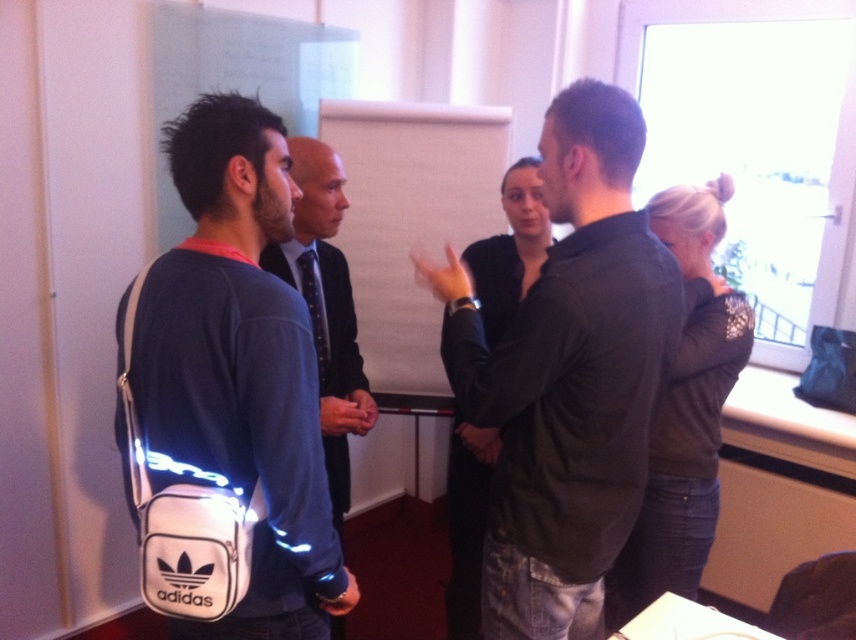
You are organizing a meeting and need to place a name tag on the table between the white synthetic adidas bag at left and the blue denim shirt at center. Which side of the table should you place it closer to so it is equidistant to both?

The white synthetic adidas bag at left is positioned on the left side of the blue denim shirt at center. To place the name tag equidistant between them, position it directly in the middle of the table between the two objects.

You are organizing a presentation and need to place a name tag on the white synthetic adidas bag at left and the blue denim shirt at center. Which object requires a larger name tag?

The blue denim shirt at center requires a larger name tag because it is taller than the white synthetic adidas bag at left.

You are organizing a presentation and need to arrange seating for attendees. The dark green shirt at center and the white synthetic adidas bag at left are present. Which object requires more space due to its size?

The dark green shirt at center has a larger size compared to the white synthetic adidas bag at left, so it requires more space.